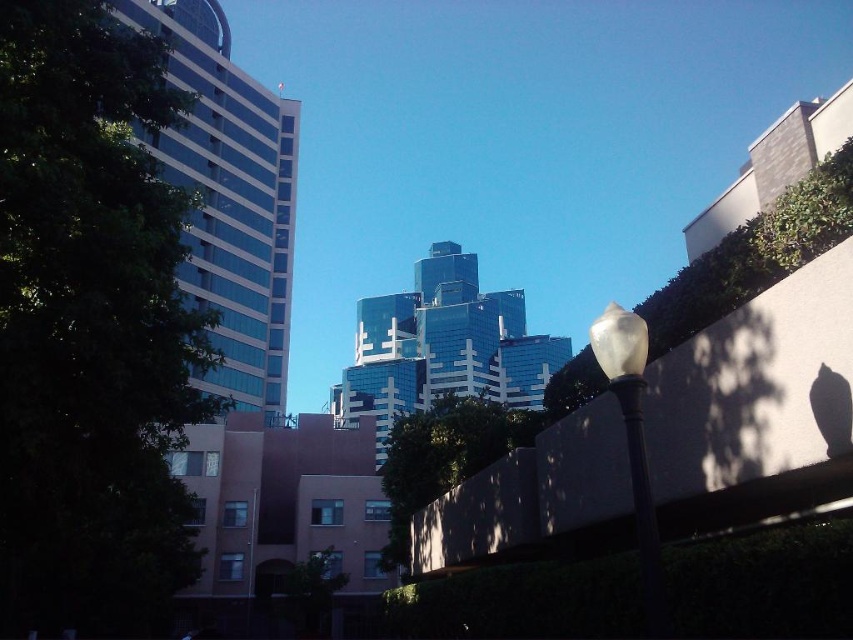
Between point (622, 440) and point (656, 532), which one is positioned in front?

Positioned in front is point (656, 532).

The image size is (853, 640). What are the coordinates of `concrete wall at center` in the screenshot? It's located at (756, 404).